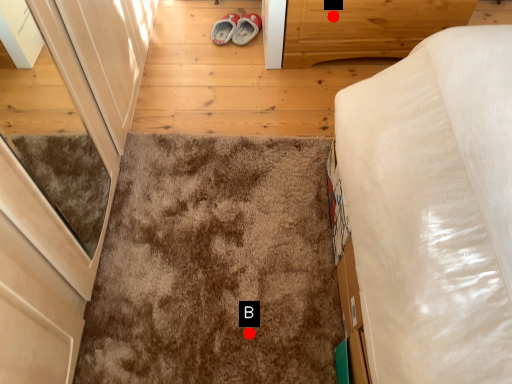
Question: Two points are circled on the image, labeled by A and B beside each circle. Which point is farther to the camera?

Choices:
 (A) A is further
 (B) B is further

Answer: (A)